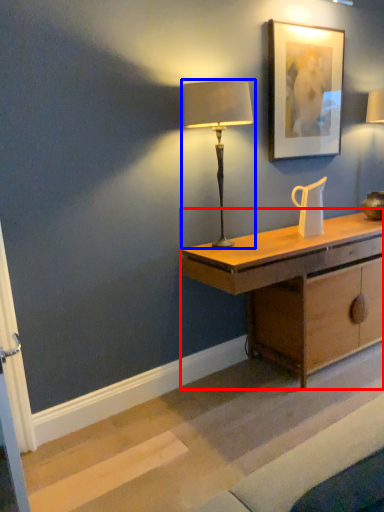
Question: Which object is closer to the camera taking this photo, desk (highlighted by a red box) or lamp (highlighted by a blue box)?

Choices:
 (A) desk
 (B) lamp

Answer: (B)